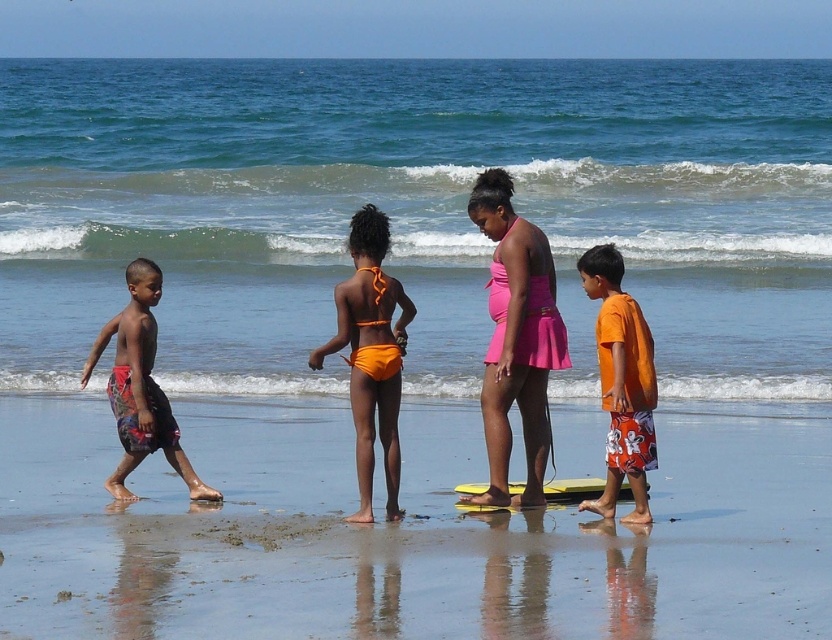
Who is positioned more to the right, orange fabric bikini at center or orange printed shorts at right?

orange printed shorts at right is more to the right.

Which is below, orange fabric bikini at center or orange printed shorts at right?

orange printed shorts at right

What do you see at coordinates (370, 355) in the screenshot? The height and width of the screenshot is (640, 832). I see `orange fabric bikini at center` at bounding box center [370, 355].

At what (x,y) coordinates should I click in order to perform the action: click on orange fabric bikini at center. Please return your answer as a coordinate pair (x, y). The width and height of the screenshot is (832, 640). Looking at the image, I should click on (370, 355).

Is orange printed shorts at right bigger than multicolored printed shorts at left?

Incorrect, orange printed shorts at right is not larger than multicolored printed shorts at left.

Can you confirm if orange printed shorts at right is thinner than multicolored printed shorts at left?

Yes.

Find the location of `orange printed shorts at right`. orange printed shorts at right is located at coordinates (622, 381).

Between pink fabric skirt at center and multicolored printed shorts at left, which one has more height?

Standing taller between the two is pink fabric skirt at center.

The height and width of the screenshot is (640, 832). What do you see at coordinates (516, 339) in the screenshot?
I see `pink fabric skirt at center` at bounding box center [516, 339].

Is point (537, 387) in front of point (132, 285)?

That is True.

I want to click on pink fabric skirt at center, so click(516, 339).